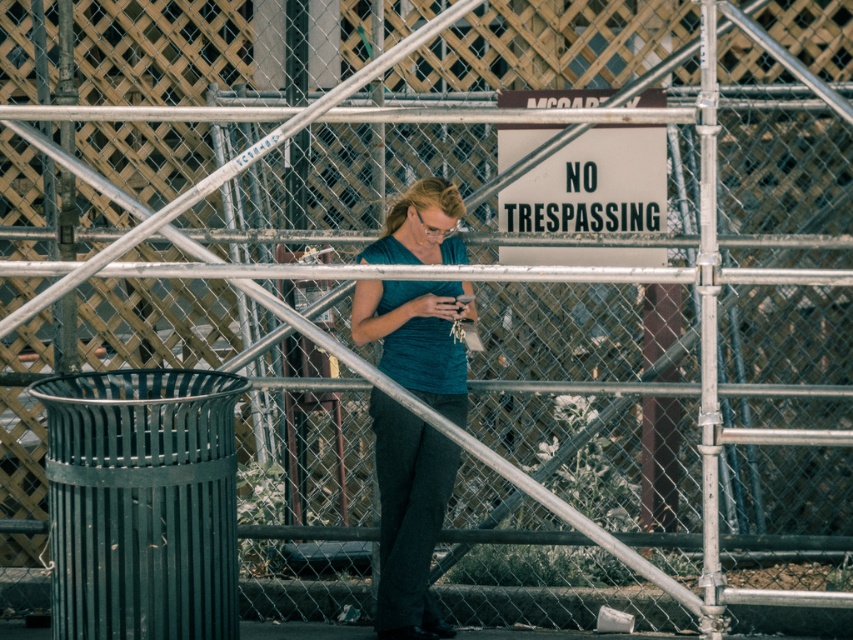
Question: Which point appears closest to the camera in this image?

Choices:
 (A) (386, 243)
 (B) (595, 138)

Answer: (A)

Question: Among these objects, which one is farthest from the camera?

Choices:
 (A) white plastic sign at center
 (B) teal fabric shirt at center

Answer: (A)

Question: Is teal fabric shirt at center below white plastic sign at center?

Choices:
 (A) no
 (B) yes

Answer: (B)

Question: Is teal fabric shirt at center to the right of white plastic sign at center from the viewer's perspective?

Choices:
 (A) yes
 (B) no

Answer: (B)

Question: Does teal fabric shirt at center appear on the left side of white plastic sign at center?

Choices:
 (A) yes
 (B) no

Answer: (A)